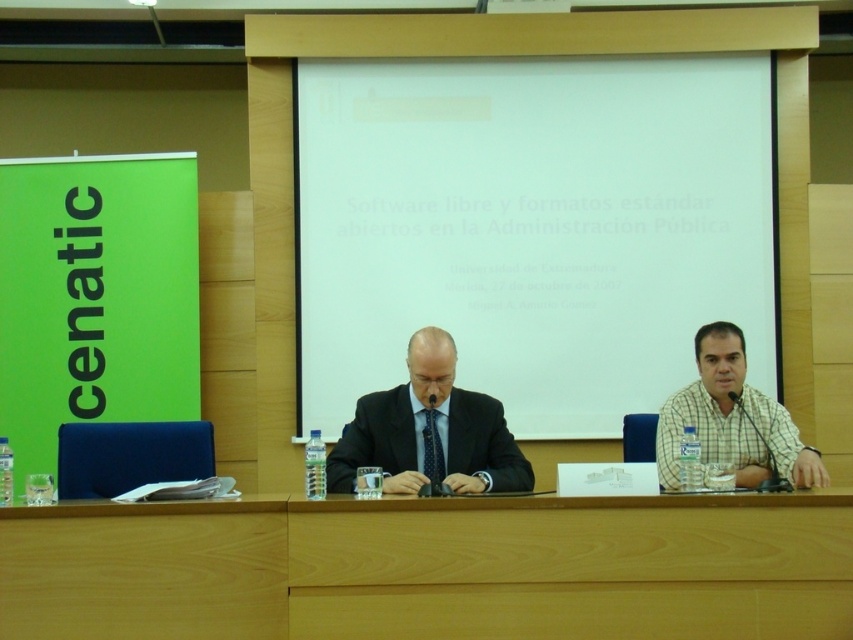
In the scene shown: You are setting up a presentation and need to place a 1.2 meter tall easel between the white matte projector screen at center and the light brown wood table at lower center. Can the easel fit vertically between these two objects without touching either?

The white matte projector screen at center is taller than the light brown wood table at lower center. Since the easel is 1.2 meters tall, it can be placed vertically between them as long as there is sufficient horizontal space, but the height difference between the screen and table does not restrict the easel placement vertically.

You are organizing a conference and need to place two name tags on the tables. The name tags must be placed on the light brown wood table at center and the light brown wood table at lower center. According to the scene description, which table should you place the first name tag on if you want it to be closer to the large screen displaying text in Spanish?

The light brown wood table at center is located above the light brown wood table at lower center, so the light brown wood table at center is closer to the large screen displaying text in Spanish. Therefore, place the first name tag on the light brown wood table at center.